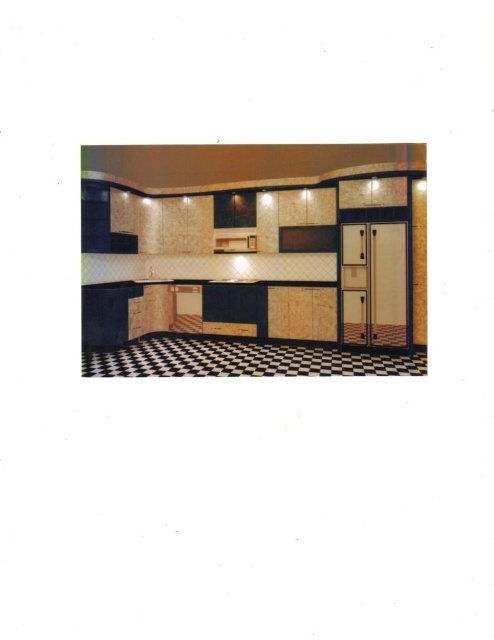
Question: Is white glossy refrigerator at right behind matte wood oven at center?

Choices:
 (A) yes
 (B) no

Answer: (B)

Question: Which object appears farthest from the camera in this image?

Choices:
 (A) matte wood oven at center
 (B) white glossy refrigerator at right

Answer: (A)

Question: Can you confirm if white glossy refrigerator at right is positioned above matte wood oven at center?

Choices:
 (A) yes
 (B) no

Answer: (B)

Question: Which point is farther from the camera taking this photo?

Choices:
 (A) (373, 232)
 (B) (235, 250)

Answer: (B)

Question: Is white glossy refrigerator at right above matte wood oven at center?

Choices:
 (A) yes
 (B) no

Answer: (B)

Question: Which point is farther to the camera?

Choices:
 (A) (244, 252)
 (B) (341, 340)

Answer: (A)